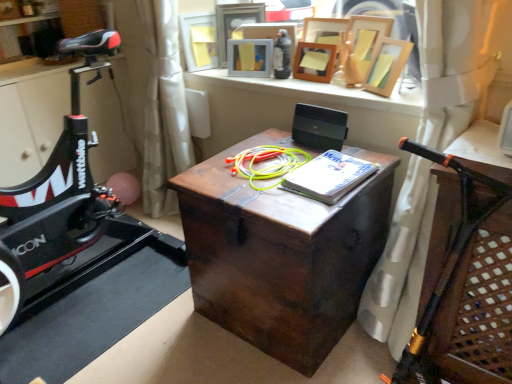
Find the location of a particular element. The image size is (512, 384). vacant space to the left of wooden picture frame at upper center, which appears as the first picture frame when viewed from the right is located at coordinates (344, 89).